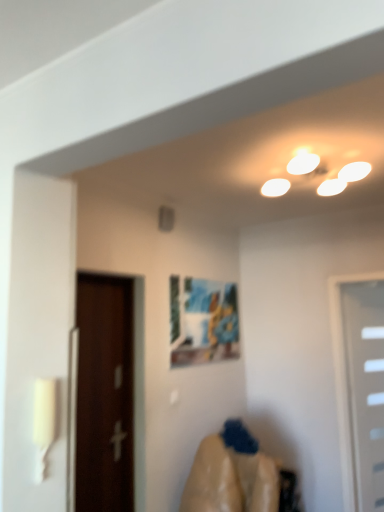
Question: Could you tell me if matte plastic picture frame at center is facing white plastic door at right, the 1th door in the back-to-front sequence?

Choices:
 (A) no
 (B) yes

Answer: (B)

Question: Considering the relative positions of matte plastic picture frame at center and white plastic door at right, acting as the second door starting from the front, in the image provided, is matte plastic picture frame at center behind white plastic door at right, acting as the second door starting from the front,?

Choices:
 (A) yes
 (B) no

Answer: (A)

Question: Is the depth of matte plastic picture frame at center less than that of white plastic door at right, the 1th door in the back-to-front sequence?

Choices:
 (A) no
 (B) yes

Answer: (A)

Question: Can you confirm if matte plastic picture frame at center is wider than white plastic door at right, which appears as the 1th door when viewed from the right?

Choices:
 (A) yes
 (B) no

Answer: (B)

Question: Is matte plastic picture frame at center smaller than white plastic door at right, which appears as the 1th door when viewed from the right?

Choices:
 (A) no
 (B) yes

Answer: (B)

Question: Is smooth beige fabric at lower center taller or shorter than brown wooden door at left, the 2th door in the right-to-left sequence?

Choices:
 (A) short
 (B) tall

Answer: (A)

Question: Considering the relative positions of smooth beige fabric at lower center and brown wooden door at left, positioned as the first door in front-to-back order, in the image provided, is smooth beige fabric at lower center to the left or to the right of brown wooden door at left, positioned as the first door in front-to-back order,?

Choices:
 (A) left
 (B) right

Answer: (B)

Question: Considering the positions of smooth beige fabric at lower center and brown wooden door at left, the second door from the back, in the image, is smooth beige fabric at lower center bigger or smaller than brown wooden door at left, the second door from the back,?

Choices:
 (A) small
 (B) big

Answer: (B)

Question: From the image's perspective, relative to brown wooden door at left, which is the first door from left to right, is smooth beige fabric at lower center above or below?

Choices:
 (A) below
 (B) above

Answer: (A)

Question: Is point (223, 358) positioned closer to the camera than point (352, 459)?

Choices:
 (A) closer
 (B) farther

Answer: (B)

Question: From the image's perspective, is matte plastic picture frame at center above or below white plastic door at right, the second door in the left-to-right sequence?

Choices:
 (A) above
 (B) below

Answer: (A)

Question: From a real-world perspective, is matte plastic picture frame at center above or below white plastic door at right, which appears as the 1th door when viewed from the right?

Choices:
 (A) below
 (B) above

Answer: (B)

Question: Would you say matte plastic picture frame at center is to the left or to the right of white plastic door at right, the 1th door in the back-to-front sequence, in the picture?

Choices:
 (A) right
 (B) left

Answer: (B)

Question: Considering the positions of smooth beige fabric at lower center and matte plastic picture frame at center in the image, is smooth beige fabric at lower center wider or thinner than matte plastic picture frame at center?

Choices:
 (A) wide
 (B) thin

Answer: (A)

Question: Is point (246, 494) positioned closer to the camera than point (195, 348)?

Choices:
 (A) farther
 (B) closer

Answer: (B)